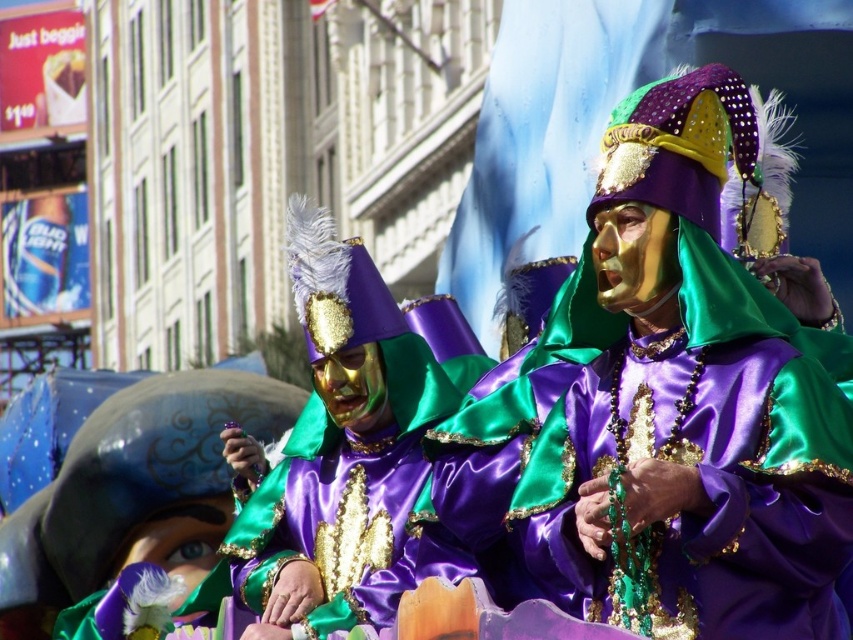
Consider the image. Does purple satin mask at center have a greater height compared to satin/golden mask at center?

No.

Who is more distant from viewer, (612, 182) or (311, 486)?

The point (311, 486) is behind.

This screenshot has width=853, height=640. What do you see at coordinates (695, 394) in the screenshot?
I see `purple satin mask at center` at bounding box center [695, 394].

Locate an element on the screen. purple satin mask at center is located at coordinates (695, 394).